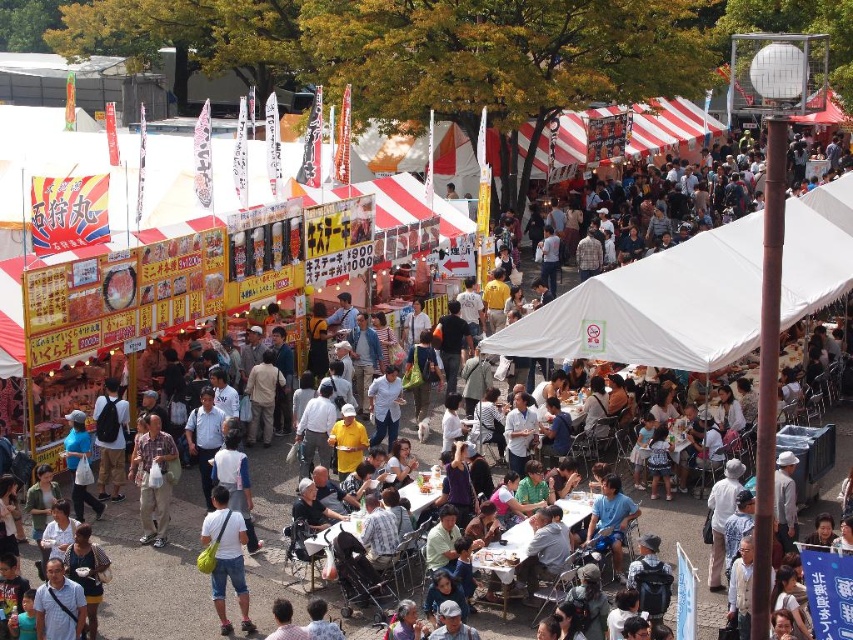
You are a photographer at the market and want to take a photo of the white fabric canopy at center and the white matte shirt at center. Which object should you focus on first if you want to capture both in the same frame without moving the camera?

Since the white fabric canopy at center is positioned on the right side of white matte shirt at center, you should focus on the white matte shirt at center first to ensure both objects are in the frame without moving the camera.

You are standing at the entrance of the market and want to locate the white fabric canopy at center. According to the coordinates provided, what are the exact coordinates where you should look to find it?

The white fabric canopy at center is located at coordinates point (656, 307).